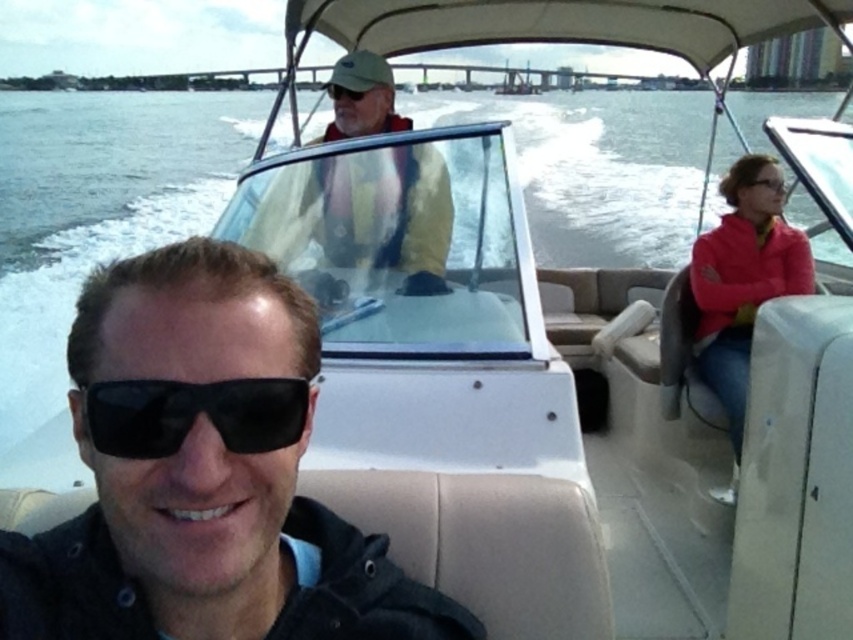
You are a photographer on the motorboat and want to take a photo of the matte red jacket at right and the matte black sunglasses at upper right. Which object should you zoom in more on to ensure both are clearly visible in the photo?

Since the matte red jacket at right is larger in size than the matte black sunglasses at upper right, you should zoom in more on the matte black sunglasses at upper right to ensure both are clearly visible in the photo.

You are a photographer on the motorboat and want to capture both the matte red jacket at right and the matte black sunglasses at upper right in a single photo. However, your camera has a limited depth of field and can only focus on one object at a time. Which object should you focus on to ensure the other remains relatively in focus due to their spatial relationship?

You should focus on the matte red jacket at right because it is taller than the matte black sunglasses at upper right. Since the matte red jacket at right has greater height, focusing on it would keep the matte black sunglasses at upper right relatively in focus due to their proximity in the frame.